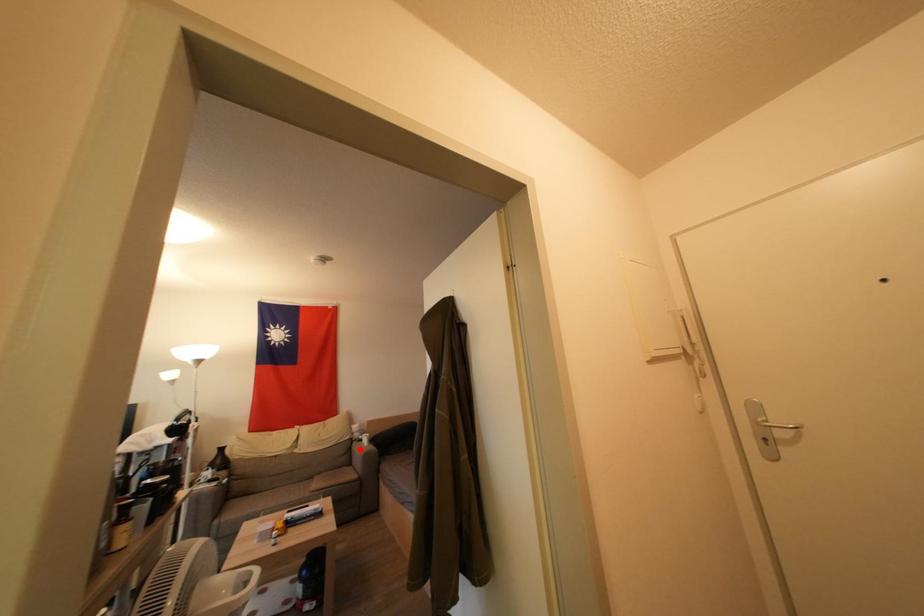
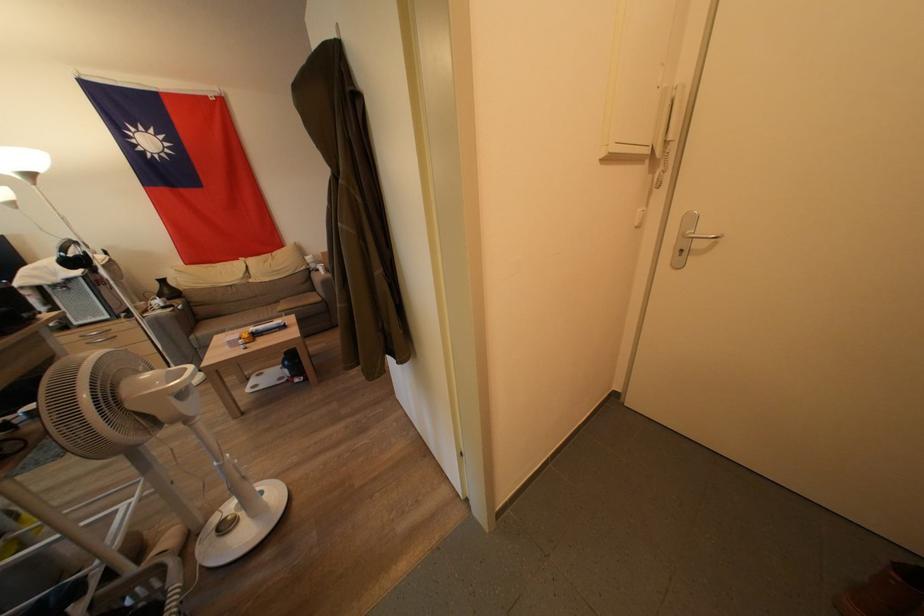
Question: I am providing you with two images of the same scene from different viewpoints. In image1, a red point is highlighted. Considering the same 3D point in image2, which of the following is correct?

Choices:
 (A) It is closer
 (B) It is farther

Answer: (B)